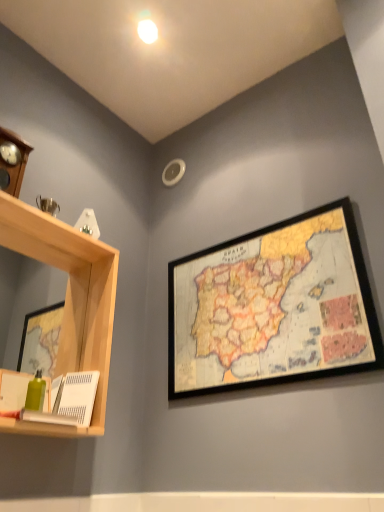
Describe the element at coordinates (273, 307) in the screenshot. I see `wooden framed map at upper right` at that location.

What are the coordinates of `wooden framed map at upper right` in the screenshot? It's located at (273, 307).

Locate an element on the screen. Image resolution: width=384 pixels, height=512 pixels. light wood shelf at left is located at coordinates (69, 300).

The image size is (384, 512). What do you see at coordinates (69, 300) in the screenshot? I see `light wood shelf at left` at bounding box center [69, 300].

Image resolution: width=384 pixels, height=512 pixels. I want to click on wooden framed map at upper right, so click(273, 307).

Does light wood shelf at left appear on the right side of wooden framed map at upper right?

Incorrect, light wood shelf at left is not on the right side of wooden framed map at upper right.

Is light wood shelf at left in front of or behind wooden framed map at upper right in the image?

Visually, light wood shelf at left is located in front of wooden framed map at upper right.

Which is behind, point (87, 431) or point (181, 367)?

The point (181, 367) is farther from the camera.

From the image's perspective, which is below, light wood shelf at left or wooden framed map at upper right?

light wood shelf at left is shown below in the image.

From a real-world perspective, is light wood shelf at left physically located above or below wooden framed map at upper right?

light wood shelf at left is below wooden framed map at upper right.

Is light wood shelf at left wider than wooden framed map at upper right?

Indeed, light wood shelf at left has a greater width compared to wooden framed map at upper right.

Considering the sizes of light wood shelf at left and wooden framed map at upper right in the image, is light wood shelf at left taller or shorter than wooden framed map at upper right?

light wood shelf at left is taller than wooden framed map at upper right.

In terms of size, does light wood shelf at left appear bigger or smaller than wooden framed map at upper right?

Clearly, light wood shelf at left is larger in size than wooden framed map at upper right.

Would you say light wood shelf at left contains wooden framed map at upper right?

Definitely not — wooden framed map at upper right is not inside light wood shelf at left.

Are light wood shelf at left and wooden framed map at upper right located far from each other?

No, light wood shelf at left is in close proximity to wooden framed map at upper right.

Is light wood shelf at left aimed at wooden framed map at upper right?

No, light wood shelf at left is not facing towards wooden framed map at upper right.

Measure the distance from light wood shelf at left to wooden framed map at upper right.

48.85 centimeters.

Identify the location of picture frame that appears above the light wood shelf at left (from a real-world perspective). (273, 307).

Considering the relative positions of wooden framed map at upper right and light wood shelf at left in the image provided, is wooden framed map at upper right to the left or to the right of light wood shelf at left?

Clearly, wooden framed map at upper right is on the right of light wood shelf at left in the image.

Is wooden framed map at upper right further to the viewer compared to light wood shelf at left?

Yes, the depth of wooden framed map at upper right is greater than that of light wood shelf at left.

Considering the positions of points (328, 362) and (34, 424), is point (328, 362) closer to camera compared to point (34, 424)?

No, (328, 362) is further to viewer.

From the image's perspective, which object appears higher, wooden framed map at upper right or light wood shelf at left?

wooden framed map at upper right is shown above in the image.

From a real-world perspective, is wooden framed map at upper right on top of light wood shelf at left?

Correct, in the physical world, wooden framed map at upper right is higher than light wood shelf at left.

Does wooden framed map at upper right have a lesser width compared to light wood shelf at left?

Yes.

Looking at this image, who is taller, wooden framed map at upper right or light wood shelf at left?

light wood shelf at left.

Looking at the image, does wooden framed map at upper right seem bigger or smaller compared to light wood shelf at left?

Considering their sizes, wooden framed map at upper right takes up less space than light wood shelf at left.

Is wooden framed map at upper right situated inside light wood shelf at left or outside?

The correct answer is: outside.

Consider the image. Would you consider wooden framed map at upper right to be distant from light wood shelf at left?

No, wooden framed map at upper right is not far from light wood shelf at left.

Is wooden framed map at upper right aimed at light wood shelf at left?

Yes.

Can you tell me how much wooden framed map at upper right and light wood shelf at left differ in facing direction?

89.8 degrees.

The height and width of the screenshot is (512, 384). Identify the location of shelf below the wooden framed map at upper right (from the image's perspective). (69, 300).

Locate an element on the screen. This screenshot has height=512, width=384. shelf below the wooden framed map at upper right (from a real-world perspective) is located at coordinates (69, 300).

Image resolution: width=384 pixels, height=512 pixels. Identify the location of shelf below the wooden framed map at upper right (from the image's perspective). (69, 300).